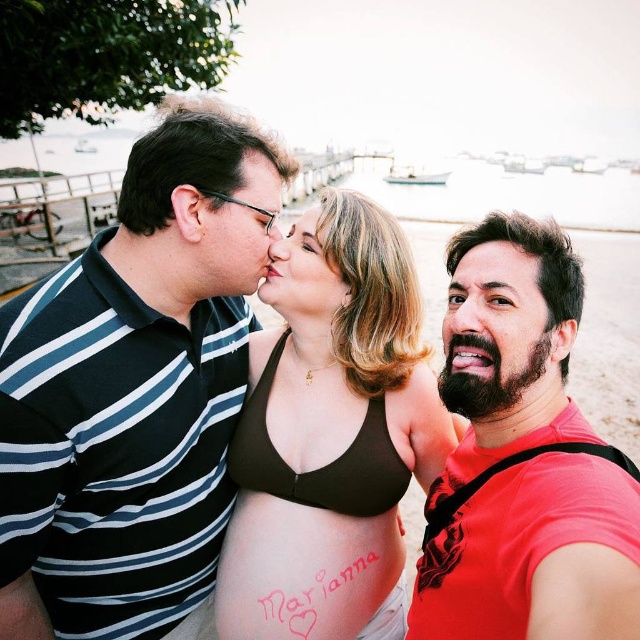
Question: Does bearded man at right have a greater width compared to smooth skin nose at center?

Choices:
 (A) no
 (B) yes

Answer: (B)

Question: Estimate the real-world distances between objects in this image. Which object is farther from the brown fabric bikini top at center?

Choices:
 (A) matte brown hair at center
 (B) matte black glasses at center
 (C) bearded man at right

Answer: (B)

Question: From the image, what is the correct spatial relationship of striped cotton polo shirt at left in relation to black matte bikini top at center?

Choices:
 (A) below
 (B) above

Answer: (B)

Question: Does striped cotton polo shirt at left appear over matte black glasses at center?

Choices:
 (A) yes
 (B) no

Answer: (B)

Question: Estimate the real-world distances between objects in this image. Which object is closer to the brown fabric bikini top at center?

Choices:
 (A) matte brown hair at center
 (B) red matte t-shirt at center

Answer: (A)

Question: Which point is farther to the camera?

Choices:
 (A) (280, 513)
 (B) (380, 401)
 (C) (269, 234)
 (D) (365, 456)

Answer: (B)